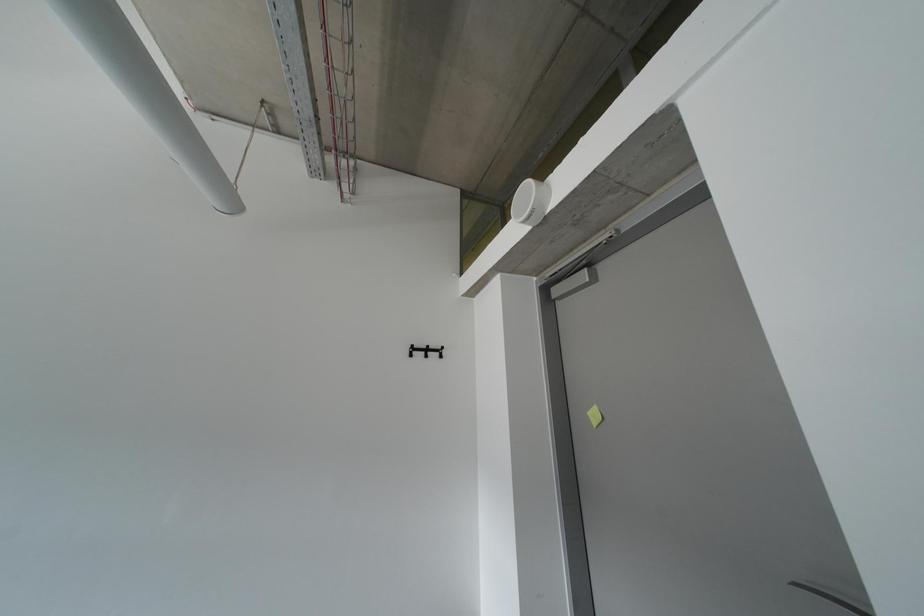
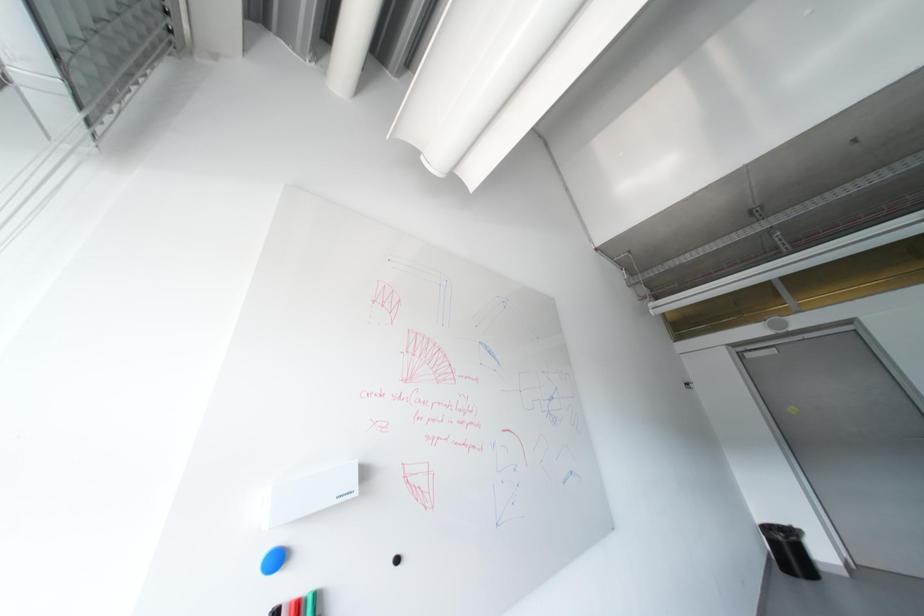
Question: The images are taken continuously from a first-person perspective. In which direction are you moving?

Choices:
 (A) Left
 (B) Right
 (C) Forward
 (D) Backward

Answer: (A)